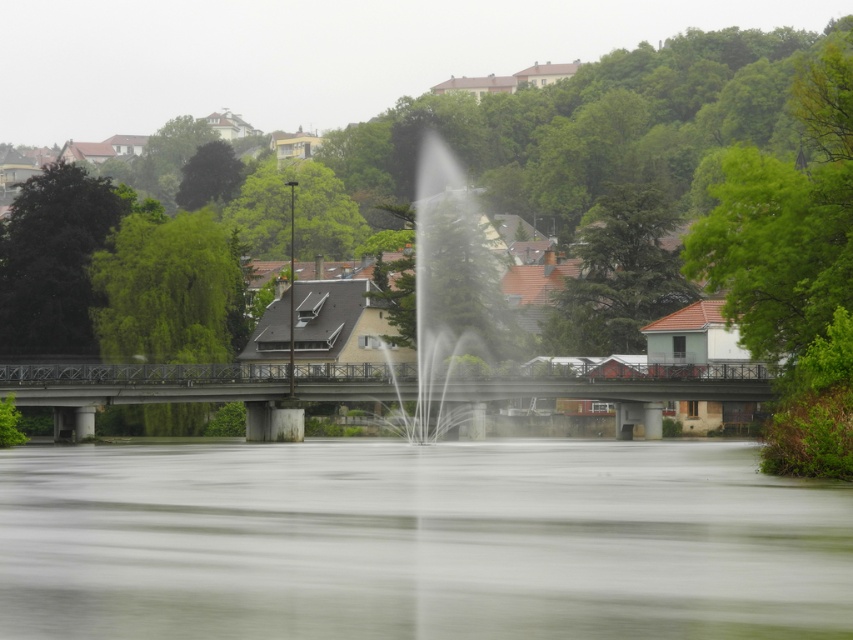
Is green leafy tree at upper left taller than green textured tree at center?

Yes, green leafy tree at upper left is taller than green textured tree at center.

Does point (106, 227) lie in front of point (595, 301)?

Yes, it is.

Is point (45, 280) farther from viewer compared to point (672, 256)?

No, it is not.

The width and height of the screenshot is (853, 640). Find the location of `green leafy tree at upper left`. green leafy tree at upper left is located at coordinates (53, 260).

Does clear water fountain at center appear on the left side of green leafy tree at upper center?

In fact, clear water fountain at center is to the right of green leafy tree at upper center.

Is clear water fountain at center below green leafy tree at upper center?

Yes.

Between point (425, 390) and point (326, 244), which one is positioned in front?

Positioned in front is point (425, 390).

You are a GUI agent. You are given a task and a screenshot of the screen. Output one action in this format:
    pyautogui.click(x=<x>, y=<y>)
    Task: Click on the clear water fountain at center
    The height and width of the screenshot is (640, 853).
    Given the screenshot: What is the action you would take?
    pyautogui.click(x=448, y=282)

Image resolution: width=853 pixels, height=640 pixels. Describe the element at coordinates (167, 291) in the screenshot. I see `green leafy tree at left` at that location.

Does green leafy tree at left have a smaller size compared to green textured tree at center?

Indeed, green leafy tree at left has a smaller size compared to green textured tree at center.

Who is more forward, [170,352] or [604,204]?

Positioned in front is point [170,352].

I want to click on green leafy tree at left, so click(167, 291).